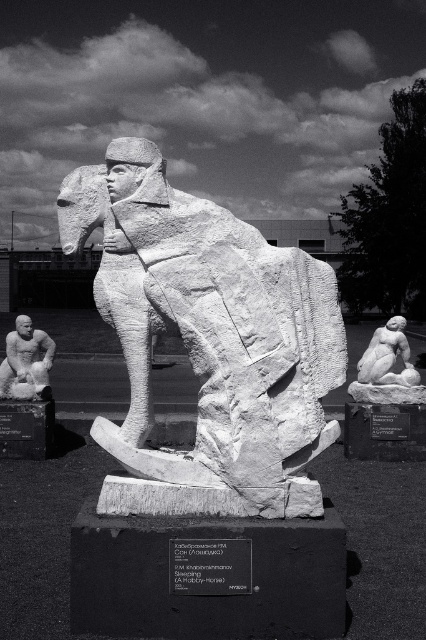
In the scene shown: You are an art critic analyzing the sculpture. You notice the white stone horse at center and the smooth stone man at center. Which object is positioned closer to you in the sculpture?

The white stone horse at center is closer to the viewer than the smooth stone man at center.

You are an art curator examining the sculpture. You notice the white stone horse at center and the white marble reclining figure at lower right. From your viewpoint, which object is closer to you?

The white stone horse at center is closer to you because it is positioned in front of the white marble reclining figure at lower right.

You are an art conservator tasked with moving the sculpture pieces. The white stone horse at center and the white marble reclining figure at lower right need to be transported to a new exhibition space. The doorway you must use has a maximum clearance of 4 meters between objects. Can both pieces be moved through the doorway without being damaged?

The distance between the white stone horse at center and the white marble reclining figure at lower right is 3.94 meters, which is under the 4 meter clearance limit. Therefore, both pieces can be moved through the doorway without damage.